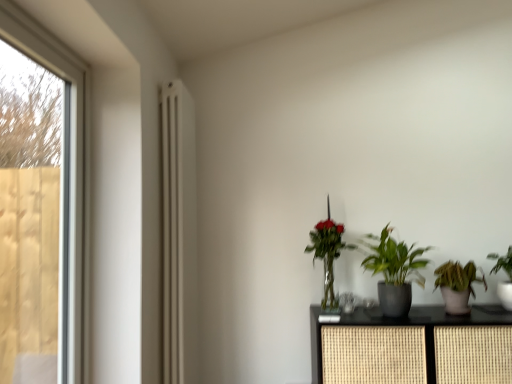
Question: Does green leafy plant at right, which is counted as the 4th houseplant, starting from the left, have a larger size compared to matte white radiator at left?

Choices:
 (A) yes
 (B) no

Answer: (B)

Question: Does green leafy plant at right, the first houseplant when ordered from right to left, appear on the left side of matte white radiator at left?

Choices:
 (A) no
 (B) yes

Answer: (A)

Question: Can you confirm if green leafy plant at right, the first houseplant when ordered from right to left, is shorter than matte white radiator at left?

Choices:
 (A) no
 (B) yes

Answer: (B)

Question: Is green leafy plant at right, the first houseplant when ordered from right to left, not within matte white radiator at left?

Choices:
 (A) no
 (B) yes

Answer: (B)

Question: Are green leafy plant at right, the first houseplant when ordered from right to left, and matte white radiator at left located far from each other?

Choices:
 (A) no
 (B) yes

Answer: (B)

Question: Considering the positions of point (444, 278) and point (324, 301), is point (444, 278) closer or farther from the camera than point (324, 301)?

Choices:
 (A) farther
 (B) closer

Answer: (B)

Question: In terms of width, does green matte houseplant at lower right, positioned as the second houseplant in right-to-left order, look wider or thinner when compared to green glossy plant at center, which appears as the 4th houseplant when viewed from the right?

Choices:
 (A) thin
 (B) wide

Answer: (B)

Question: Looking at the image, does green matte houseplant at lower right, which ranks as the 3th houseplant in left-to-right order, seem bigger or smaller compared to green glossy plant at center, which appears as the 4th houseplant when viewed from the right?

Choices:
 (A) small
 (B) big

Answer: (A)

Question: Which is correct: green matte houseplant at lower right, which ranks as the 3th houseplant in left-to-right order, is inside green glossy plant at center, the first houseplant in the left-to-right sequence, or outside of it?

Choices:
 (A) outside
 (B) inside

Answer: (A)

Question: From the image's perspective, relative to green matte houseplant at lower right, which ranks as the 3th houseplant in left-to-right order, is green glossy plant at center, which appears as the 4th houseplant when viewed from the right, above or below?

Choices:
 (A) below
 (B) above

Answer: (B)

Question: Based on their sizes in the image, would you say green glossy plant at center, the first houseplant in the left-to-right sequence, is bigger or smaller than green matte houseplant at lower right, which ranks as the 3th houseplant in left-to-right order?

Choices:
 (A) small
 (B) big

Answer: (B)

Question: Considering the positions of green glossy plant at center, which appears as the 4th houseplant when viewed from the right, and green matte houseplant at lower right, which ranks as the 3th houseplant in left-to-right order, in the image, is green glossy plant at center, which appears as the 4th houseplant when viewed from the right, taller or shorter than green matte houseplant at lower right, which ranks as the 3th houseplant in left-to-right order,?

Choices:
 (A) short
 (B) tall

Answer: (B)

Question: Is point (311, 233) closer or farther from the camera than point (470, 271)?

Choices:
 (A) farther
 (B) closer

Answer: (A)

Question: In terms of height, does green matte houseplant at lower right, which ranks as the 3th houseplant in left-to-right order, look taller or shorter compared to matte white radiator at left?

Choices:
 (A) tall
 (B) short

Answer: (B)

Question: Visually, is green matte houseplant at lower right, which ranks as the 3th houseplant in left-to-right order, positioned to the left or to the right of matte white radiator at left?

Choices:
 (A) right
 (B) left

Answer: (A)